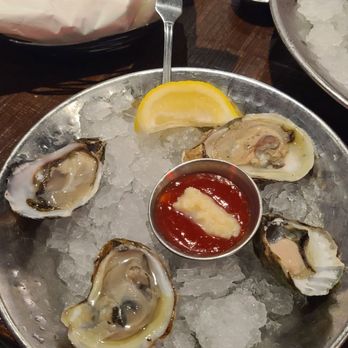
Locate an element on the screen. This screenshot has width=348, height=348. metal bowl is located at coordinates (17, 322), (291, 37).